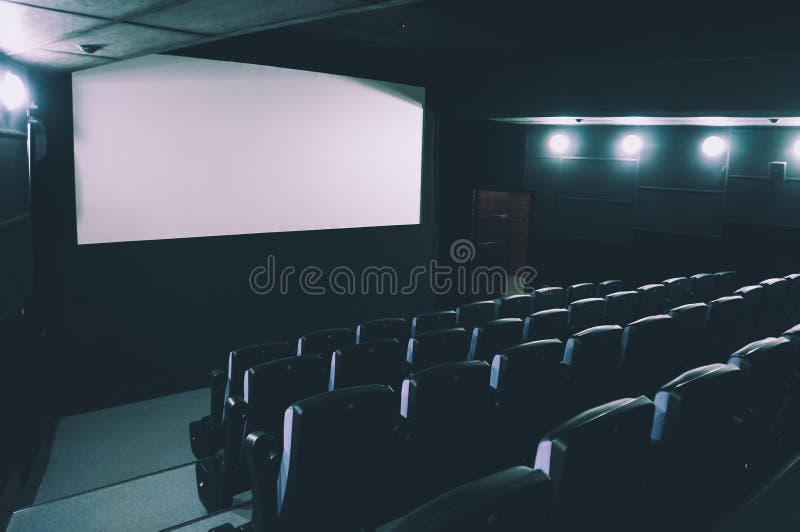
Locate an element on the screen. wall-mounted lights, turned on is located at coordinates (566, 149), (630, 149), (708, 148), (796, 146), (13, 99).